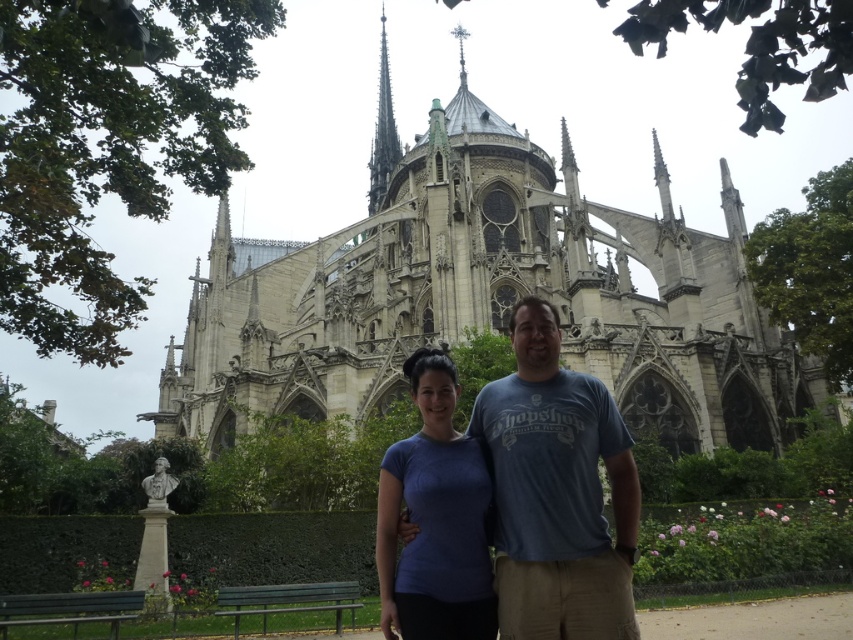
Question: Can you confirm if blue cotton shirt at center is positioned to the right of gray stone spire at upper center?

Choices:
 (A) no
 (B) yes

Answer: (B)

Question: Estimate the real-world distances between objects in this image. Which object is closer to the blue fabric shirt at center?

Choices:
 (A) blue cotton shirt at center
 (B) stone gothic cathedral at center

Answer: (A)

Question: Does stone gothic cathedral at center appear on the right side of blue cotton shirt at center?

Choices:
 (A) yes
 (B) no

Answer: (B)

Question: Which object is farther from the camera taking this photo?

Choices:
 (A) blue cotton shirt at center
 (B) blue fabric shirt at center
 (C) gray stone spire at upper center
 (D) stone gothic cathedral at center

Answer: (C)

Question: Estimate the real-world distances between objects in this image. Which object is closer to the stone gothic cathedral at center?

Choices:
 (A) gray stone spire at upper center
 (B) blue cotton shirt at center
 (C) blue fabric shirt at center

Answer: (C)

Question: From the image, what is the correct spatial relationship of stone gothic cathedral at center in relation to blue cotton shirt at center?

Choices:
 (A) right
 (B) left

Answer: (B)